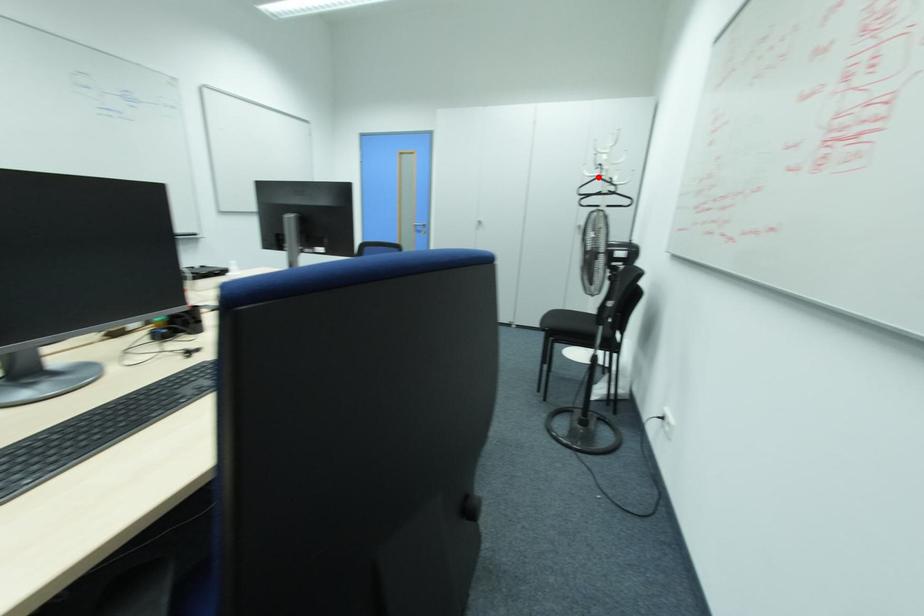
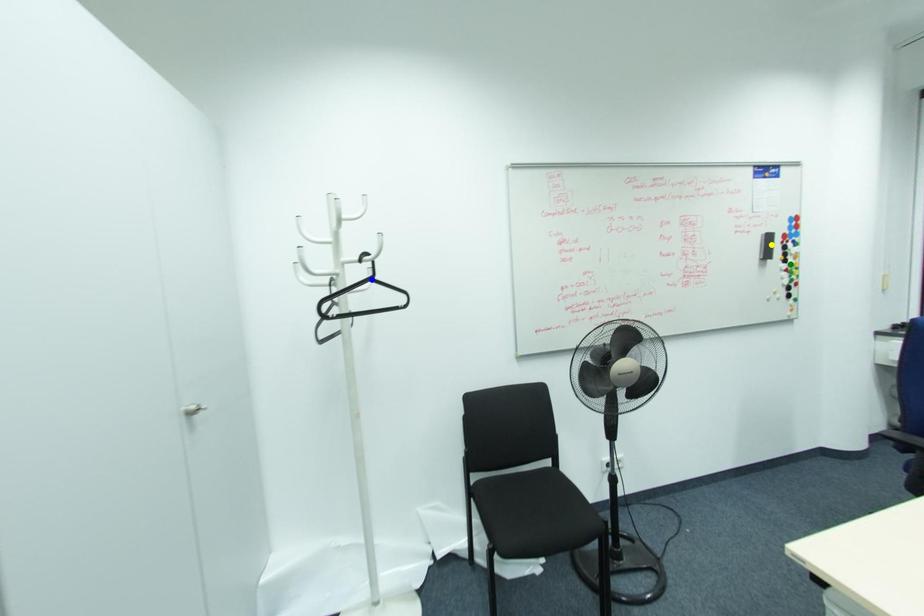
Question: I am providing you with two images of the same scene from different viewpoints. A red point is marked on the first image. You are given multiple points on the second image. Can you choose the point in image 2 that corresponds to the point in image 1?

Choices:
 (A) yellow point
 (B) green point
 (C) blue point

Answer: (C)